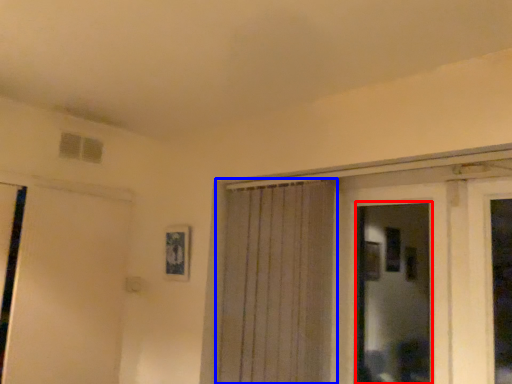
Question: Which point is closer to the camera, bay window (highlighted by a red box) or curtain (highlighted by a blue box)?

Choices:
 (A) bay window
 (B) curtain

Answer: (A)